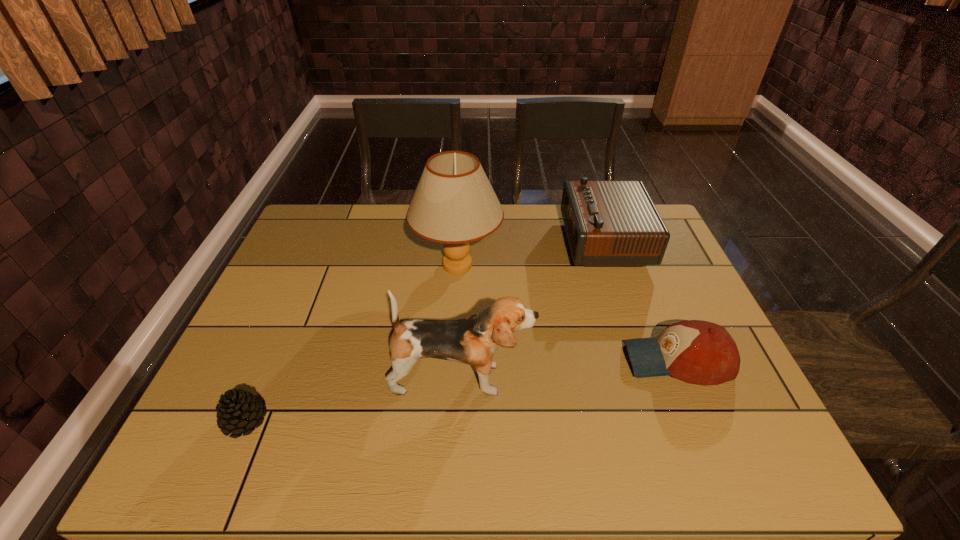
Identify the location of lampshade. Image resolution: width=960 pixels, height=540 pixels. (454, 203).

At what (x,y) coordinates should I click in order to perform the action: click on the second tallest object. Please return your answer as a coordinate pair (x, y). Looking at the image, I should click on (473, 340).

Where is `radio receiver`? The width and height of the screenshot is (960, 540). radio receiver is located at coordinates (608, 223).

Image resolution: width=960 pixels, height=540 pixels. Identify the location of baseball cap. (698, 352).

Find the location of a particular element. This screenshot has width=960, height=540. pinecone is located at coordinates (237, 411).

The image size is (960, 540). In order to click on the leftmost object in this screenshot , I will do point(237,411).

Identify the location of vacant space located 0.050m on the back of the lampshade. This screenshot has height=540, width=960. (460, 230).

Where is `free space located at the face of the fourth shortest object`? The width and height of the screenshot is (960, 540). free space located at the face of the fourth shortest object is located at coordinates (660, 378).

This screenshot has height=540, width=960. What are the coordinates of `vacant space located on the front panel of the third shortest object` in the screenshot? It's located at (443, 241).

Find the location of a particular element. The height and width of the screenshot is (540, 960). free space located on the front panel of the third shortest object is located at coordinates (461, 241).